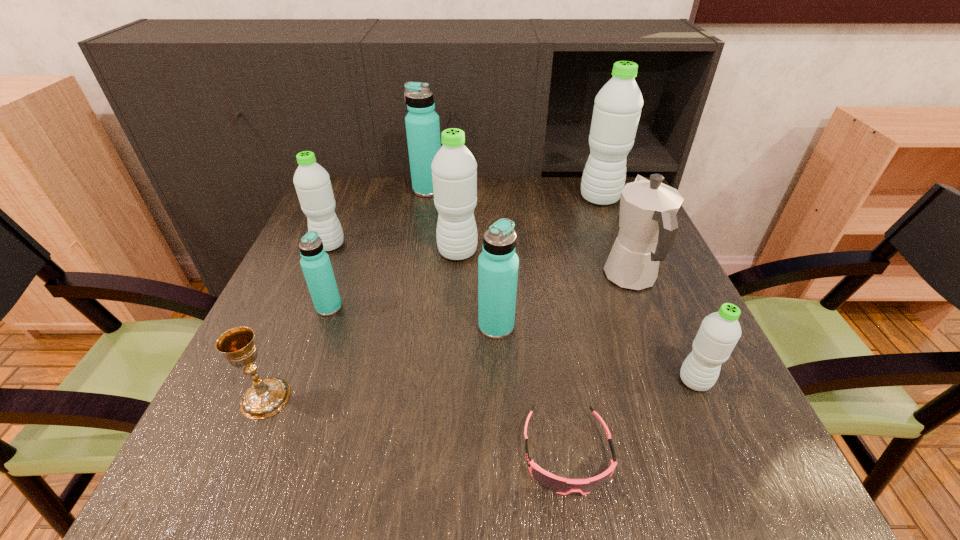
Where is `the tallest object`? the tallest object is located at coordinates (617, 109).

The width and height of the screenshot is (960, 540). In order to click on the tallest water bottle in this screenshot , I will do `click(617, 109)`.

Where is `the farthest blue water bottle`? Image resolution: width=960 pixels, height=540 pixels. the farthest blue water bottle is located at coordinates (422, 123).

The image size is (960, 540). In order to click on the seventh object from right to left in this screenshot , I will do `click(422, 123)`.

Locate an element on the screen. The image size is (960, 540). the sixth object from right to left is located at coordinates coord(454,169).

Locate an element on the screen. the third smallest green water bottle is located at coordinates (454, 169).

You are a GUI agent. You are given a task and a screenshot of the screen. Output one action in this format:
    pyautogui.click(x=<x>, y=<y>)
    Task: Click on the gray coffeepot
    Image resolution: width=960 pixels, height=540 pixels.
    Given the screenshot: What is the action you would take?
    pyautogui.click(x=648, y=224)

Image resolution: width=960 pixels, height=540 pixels. Find the location of `the second smallest green water bottle`. the second smallest green water bottle is located at coordinates [x=312, y=182].

Locate an element on the screen. The width and height of the screenshot is (960, 540). the fifth water bottle from left to right is located at coordinates (498, 264).

Where is `the rightmost blue water bottle`? The height and width of the screenshot is (540, 960). the rightmost blue water bottle is located at coordinates (498, 264).